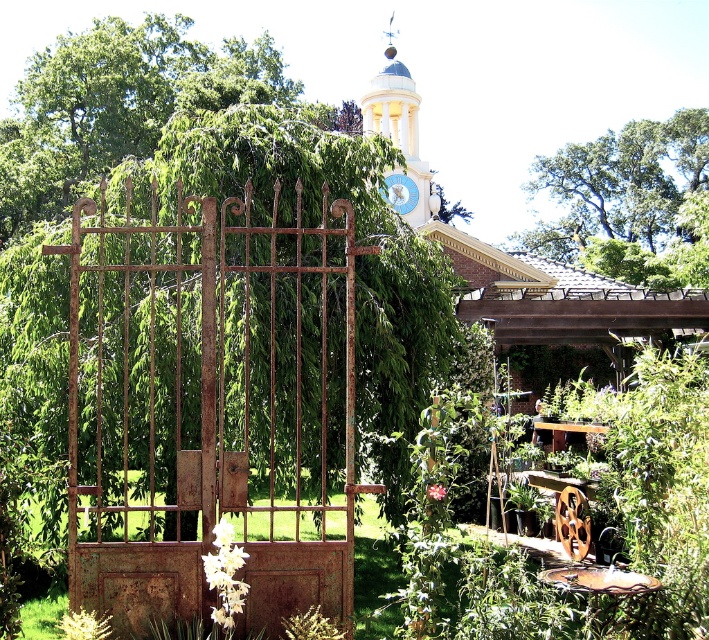
Question: Where is white painted stone clock tower at upper center located in relation to metallic clock at center in the image?

Choices:
 (A) below
 (B) above

Answer: (B)

Question: Is green leafy tree at upper center behind white painted stone clock tower at upper center?

Choices:
 (A) no
 (B) yes

Answer: (B)

Question: Which point is farther to the camera?

Choices:
 (A) (174, 544)
 (B) (593, 173)
 (C) (390, 198)
 (D) (390, 132)

Answer: (B)

Question: Which point is closer to the camera?

Choices:
 (A) (296, 547)
 (B) (593, 156)
 (C) (396, 204)
 (D) (238, 205)

Answer: (A)

Question: Is green leafy tree at upper center below metallic clock at center?

Choices:
 (A) no
 (B) yes

Answer: (A)

Question: Based on their relative distances, which object is nearer to the rusty metal gate at center?

Choices:
 (A) rusty metal gate at left
 (B) metallic clock at center

Answer: (A)